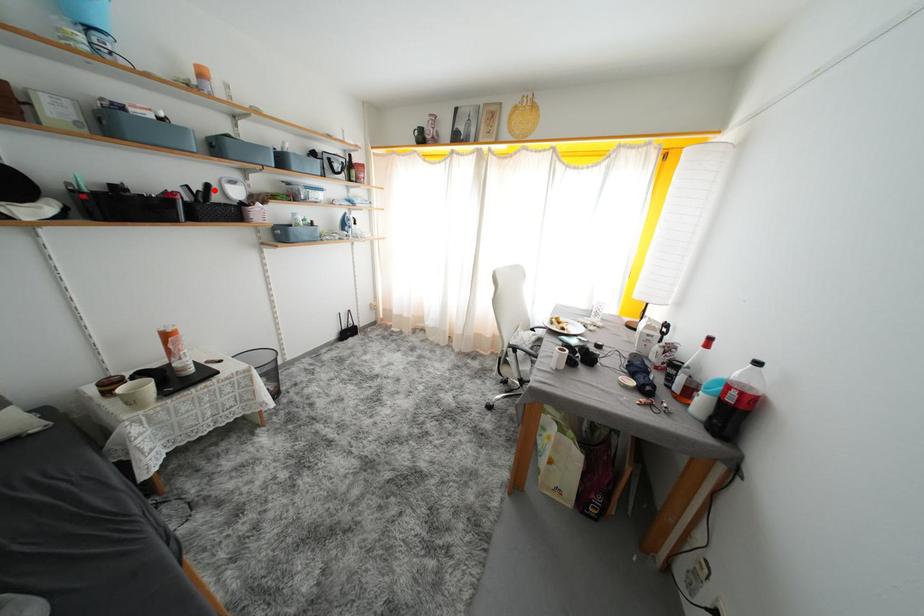
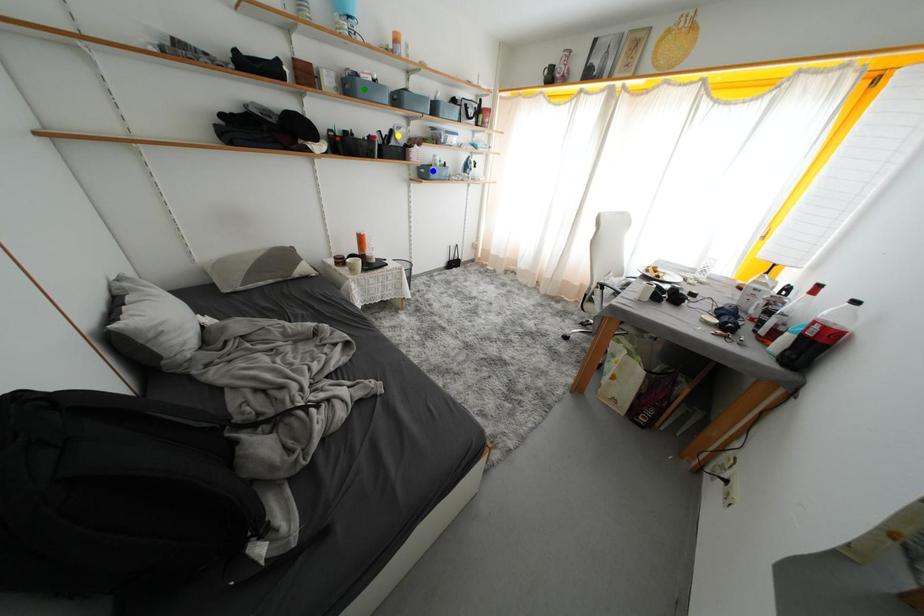
Question: I am providing you with two images of the same scene from different viewpoints. A red point is marked on the first image. You are given multiple points on the second image. Which point in image 2 is actually the same real-world point as the red point in image 1?

Choices:
 (A) blue point
 (B) green point
 (C) yellow point

Answer: (C)